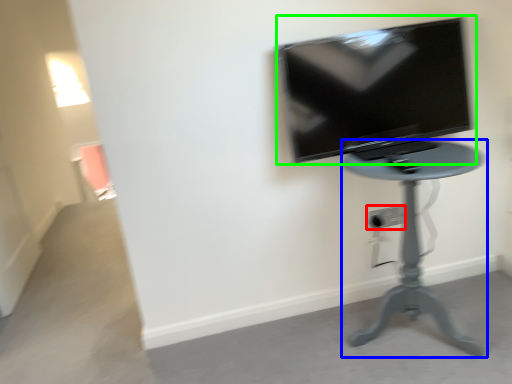
Question: Which object is the closest to the electric outlet (highlighted by a red box)? Choose among these: furniture (highlighted by a blue box) or television (highlighted by a green box).

Choices:
 (A) furniture
 (B) television

Answer: (A)